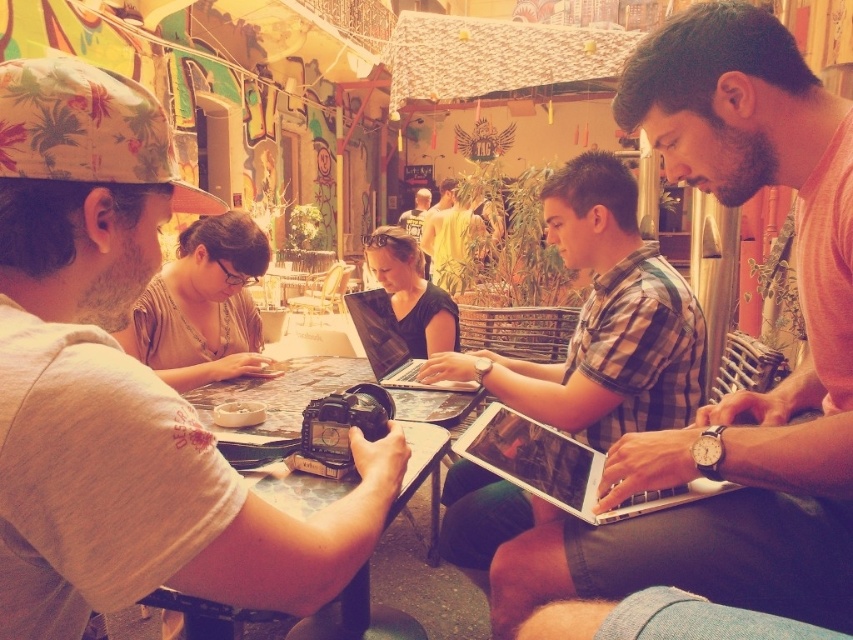
Question: Which point appears farthest from the camera in this image?

Choices:
 (A) (424, 188)
 (B) (585, 458)
 (C) (572, 221)
 (D) (424, 344)

Answer: (A)

Question: Estimate the real-world distances between objects in this image. Which object is closer to the matte black laptop at center?

Choices:
 (A) light brown shirt at center
 (B) matte brown shirt at center
 (C) yellow matte shirt at center
 (D) black glossy laptop at center

Answer: (D)

Question: Is matte black laptop at center to the right of light brown shirt at center from the viewer's perspective?

Choices:
 (A) yes
 (B) no

Answer: (A)

Question: Is matte brown shirt at center wider than black glossy laptop at center?

Choices:
 (A) no
 (B) yes

Answer: (B)

Question: Does beige cotton shirt at left have a smaller size compared to matte black laptop at center?

Choices:
 (A) yes
 (B) no

Answer: (A)

Question: Considering the real-world distances, which object is closest to the wooden table at center?

Choices:
 (A) light brown shirt at center
 (B) beige cotton shirt at left
 (C) silver metallic laptop at center
 (D) yellow matte shirt at center

Answer: (C)